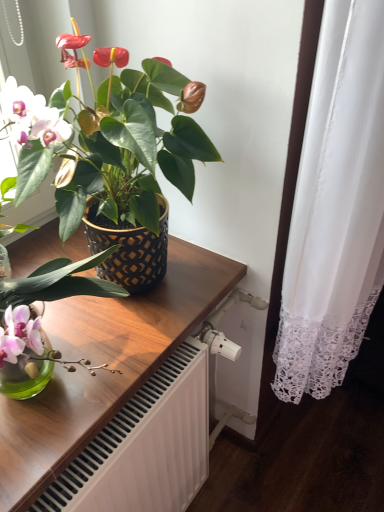
Measure the distance between point (192, 282) and camera.

1.03 meters.

This screenshot has height=512, width=384. I want to click on wooden table at center, so click(x=103, y=362).

What do you see at coordinates (103, 362) in the screenshot?
I see `wooden table at center` at bounding box center [103, 362].

Identify the location of matte black pot at upper left. The width and height of the screenshot is (384, 512). (108, 138).

What do you see at coordinates (108, 138) in the screenshot?
I see `matte black pot at upper left` at bounding box center [108, 138].

What is the approximate width of matte black pot at upper left?

38.18 centimeters.

Where is `wooden table at center`? This screenshot has width=384, height=512. wooden table at center is located at coordinates (103, 362).

From the picture: Which object is positioned more to the left, matte black pot at upper left or wooden table at center?

wooden table at center.

Between matte black pot at upper left and wooden table at center, which one is positioned in front?

matte black pot at upper left is in front.

Is point (21, 141) in front of point (58, 386)?

Yes, point (21, 141) is in front of point (58, 386).

From the image's perspective, is matte black pot at upper left over wooden table at center?

Yes.

From a real-world perspective, is matte black pot at upper left positioned above or below wooden table at center?

Clearly, from a real-world perspective, matte black pot at upper left is above wooden table at center.

Between matte black pot at upper left and wooden table at center, which one has larger width?

matte black pot at upper left is wider.

Considering the sizes of objects matte black pot at upper left and wooden table at center in the image provided, who is taller, matte black pot at upper left or wooden table at center?

With more height is matte black pot at upper left.

Between matte black pot at upper left and wooden table at center, which one has smaller size?

Smaller between the two is wooden table at center.

Looking at this image, does matte black pot at upper left contain wooden table at center?

Yes, matte black pot at upper left is surrounding wooden table at center.

Would you consider matte black pot at upper left to be distant from wooden table at center?

matte black pot at upper left is actually quite close to wooden table at center.

Is matte black pot at upper left aimed at wooden table at center?

No, matte black pot at upper left is not aimed at wooden table at center.

Locate an element on the screen. The image size is (384, 512). table behind the matte black pot at upper left is located at coordinates (103, 362).

Would you say wooden table at center is to the left or to the right of matte black pot at upper left in the picture?

From the image, it's evident that wooden table at center is to the left of matte black pot at upper left.

Between wooden table at center and matte black pot at upper left, which one is positioned behind?

wooden table at center is further from the camera.

Does point (111, 398) come closer to viewer compared to point (117, 155)?

Yes, it is in front of point (117, 155).

Consider the image. From the image's perspective, does wooden table at center appear lower than matte black pot at upper left?

Yes.

From a real-world perspective, is wooden table at center positioned over matte black pot at upper left based on gravity?

No, from a real-world perspective, wooden table at center is not over matte black pot at upper left

Looking at this image, which of these two, wooden table at center or matte black pot at upper left, is wider?

With larger width is matte black pot at upper left.

In terms of height, does wooden table at center look taller or shorter compared to matte black pot at upper left?

In the image, wooden table at center appears to be shorter than matte black pot at upper left.

Is wooden table at center smaller than matte black pot at upper left?

Yes, wooden table at center is smaller than matte black pot at upper left.

Is wooden table at center not within matte black pot at upper left?

No, wooden table at center is not entirely external to matte black pot at upper left.

Are wooden table at center and matte black pot at upper left making contact?

wooden table at center and matte black pot at upper left are not in contact.

Is wooden table at center oriented away from matte black pot at upper left?

Correct, wooden table at center is looking away from matte black pot at upper left.

Where is `houseplant that appears above the wooden table at center (from the image's perspective)`? The height and width of the screenshot is (512, 384). houseplant that appears above the wooden table at center (from the image's perspective) is located at coordinates (108, 138).

You are a GUI agent. You are given a task and a screenshot of the screen. Output one action in this format:
    pyautogui.click(x=<x>, y=<y>)
    Task: Click on the houseplant in front of the wooden table at center
    This screenshot has height=512, width=384.
    Given the screenshot: What is the action you would take?
    pyautogui.click(x=108, y=138)

You are a GUI agent. You are given a task and a screenshot of the screen. Output one action in this format:
    pyautogui.click(x=<x>, y=<y>)
    Task: Click on the table located on the left of matte black pot at upper left
    This screenshot has width=384, height=512.
    Given the screenshot: What is the action you would take?
    pyautogui.click(x=103, y=362)